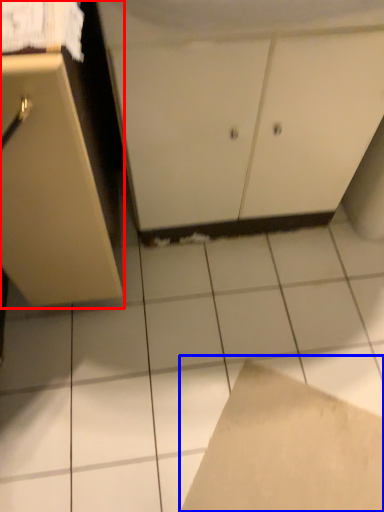
Question: Among these objects, which one is farthest to the camera, cabinetry (highlighted by a red box) or cardboard (highlighted by a blue box)?

Choices:
 (A) cabinetry
 (B) cardboard

Answer: (B)